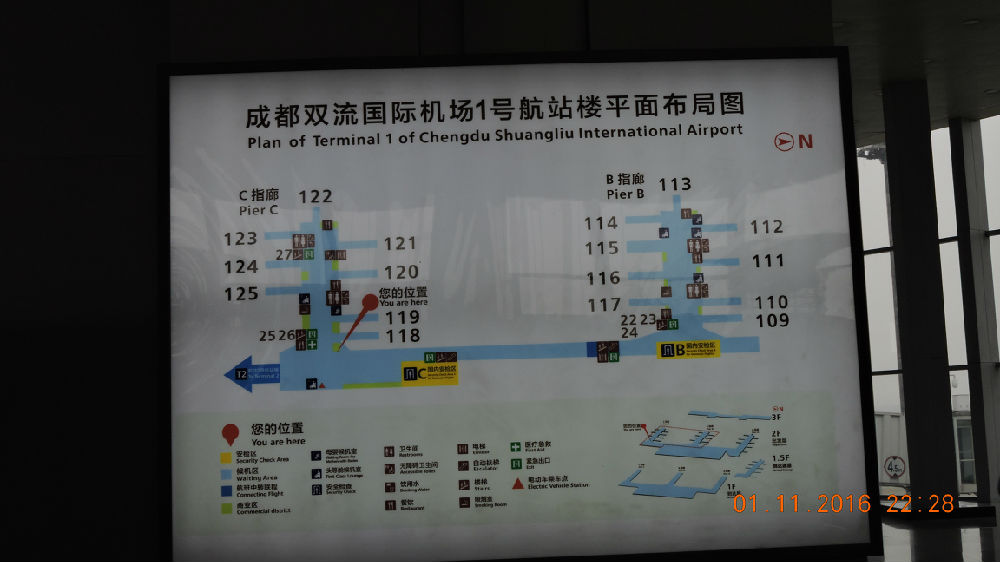
Find the location of a particular element. The width and height of the screenshot is (1000, 562). building support beam is located at coordinates (933, 368).